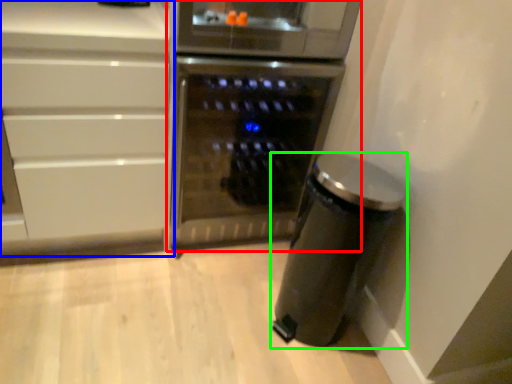
Question: Which object is positioned closest to home appliance (highlighted by a red box)? Select from cabinetry (highlighted by a blue box) and kitchen appliance (highlighted by a green box).

Choices:
 (A) cabinetry
 (B) kitchen appliance

Answer: (A)